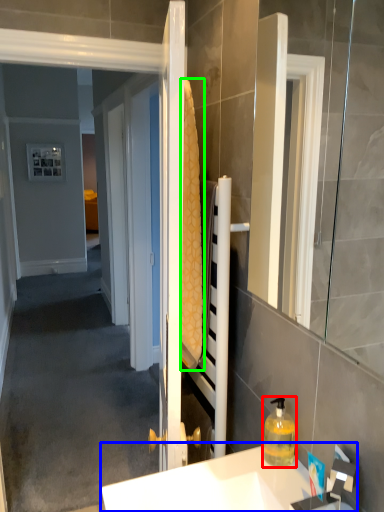
Question: Estimate the real-world distances between objects in this image. Which object is farther from bottle (highlighted by a red box), sink (highlighted by a blue box) or bath towel (highlighted by a green box)?

Choices:
 (A) sink
 (B) bath towel

Answer: (B)